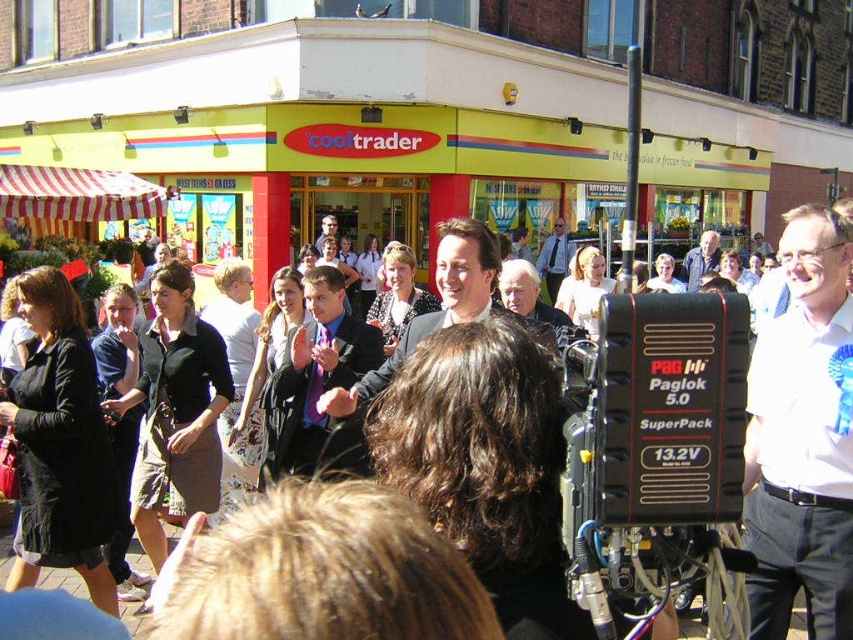
Question: Is black fabric crowd at center bigger than light blue shirt at center?

Choices:
 (A) yes
 (B) no

Answer: (A)

Question: Does black fabric crowd at center appear under smooth black suit at center?

Choices:
 (A) yes
 (B) no

Answer: (B)

Question: Is blue suit at center to the right of light blue shirt at center from the viewer's perspective?

Choices:
 (A) no
 (B) yes

Answer: (A)

Question: Which point appears closest to the camera in this image?

Choices:
 (A) (708, 244)
 (B) (555, 280)
 (C) (489, 275)
 (D) (822, 484)

Answer: (D)

Question: Based on their relative distances, which object is nearer to the light blue shirt at center?

Choices:
 (A) blue suit at center
 (B) black fabric crowd at center

Answer: (B)

Question: Which point is farther to the camera?

Choices:
 (A) pos(347,323)
 (B) pos(329,218)
 (C) pos(798,508)
 (D) pos(476,316)

Answer: (B)